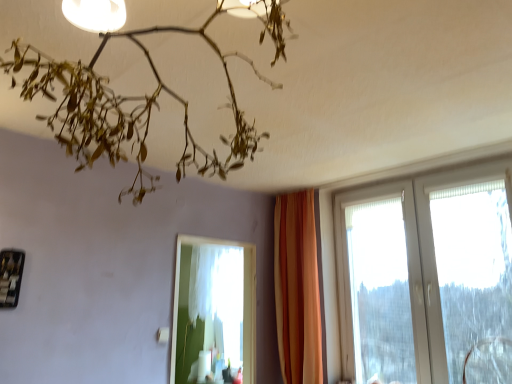
Question: From the image's perspective, is matte white lamp at upper center located above or below white sheer curtain at center?

Choices:
 (A) above
 (B) below

Answer: (A)

Question: Would you say matte white lamp at upper center is inside or outside white sheer curtain at center?

Choices:
 (A) outside
 (B) inside

Answer: (A)

Question: Which object is the closest to the metallic black picture frame at lower left?

Choices:
 (A) white sheer curtain at center
 (B) matte white lamp at upper center
 (C) white plastic window at right
 (D) transparent plastic swivel chair at lower right
 (E) orange fabric curtain at center

Answer: (B)

Question: Which is nearer to the orange fabric curtain at center?

Choices:
 (A) matte white lamp at upper center
 (B) transparent plastic swivel chair at lower right
 (C) white sheer curtain at center
 (D) metallic black picture frame at lower left
 (E) white plastic window at right

Answer: (E)